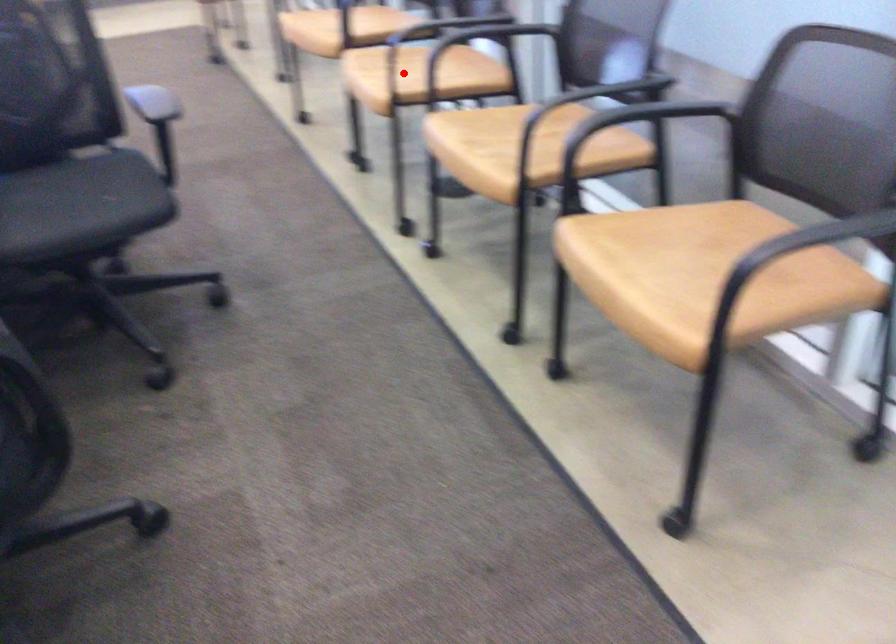
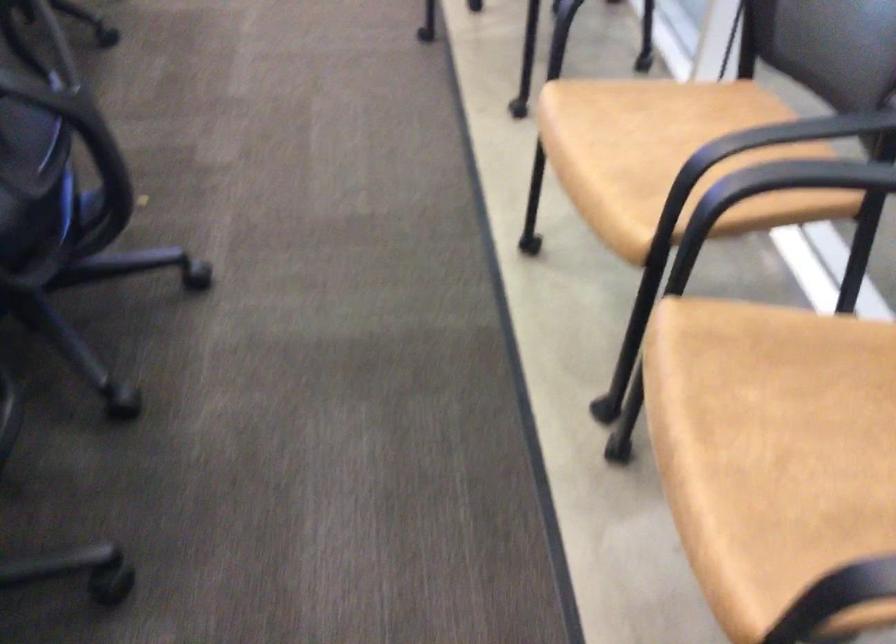
Question: I am providing you with two images of the same scene from different viewpoints. Given a red point in image1, look at the same physical point in image2. Is it:

Choices:
 (A) Closer to the viewpoint
 (B) Farther from the viewpoint

Answer: (A)